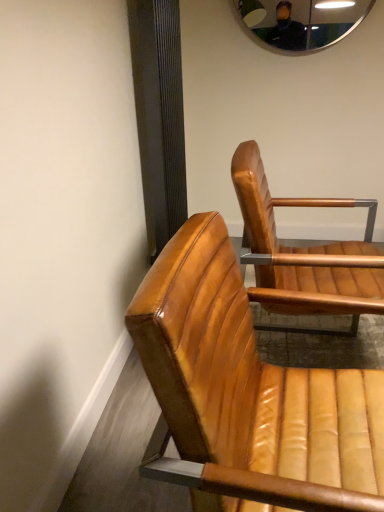
Question: Is leather chair at lower right, which is the 1th chair in front-to-back order, looking in the opposite direction of metallic reflective mirror at upper center?

Choices:
 (A) yes
 (B) no

Answer: (B)

Question: Is leather chair at lower right, positioned as the second chair in back-to-front order, touching metallic reflective mirror at upper center?

Choices:
 (A) no
 (B) yes

Answer: (A)

Question: Considering the relative positions of leather chair at lower right, positioned as the second chair in back-to-front order, and metallic reflective mirror at upper center in the image provided, is leather chair at lower right, positioned as the second chair in back-to-front order, to the right of metallic reflective mirror at upper center from the viewer's perspective?

Choices:
 (A) yes
 (B) no

Answer: (B)

Question: Can you confirm if leather chair at lower right, which is the 1th chair in front-to-back order, is taller than metallic reflective mirror at upper center?

Choices:
 (A) yes
 (B) no

Answer: (A)

Question: Would you say metallic reflective mirror at upper center is part of leather chair at lower right, positioned as the second chair in back-to-front order,'s contents?

Choices:
 (A) yes
 (B) no

Answer: (B)

Question: In terms of height, does leather chair at lower right, positioned as the second chair in back-to-front order, look taller or shorter compared to leather tan chair at center, positioned as the 1th chair in back-to-front order?

Choices:
 (A) tall
 (B) short

Answer: (B)

Question: Is leather chair at lower right, which is the 1th chair in front-to-back order, to the left or to the right of leather tan chair at center, the second chair viewed from the front, in the image?

Choices:
 (A) right
 (B) left

Answer: (B)

Question: Is leather chair at lower right, which is the 1th chair in front-to-back order, spatially inside leather tan chair at center, the second chair viewed from the front, or outside of it?

Choices:
 (A) outside
 (B) inside

Answer: (A)

Question: Looking at the image, does leather chair at lower right, positioned as the second chair in back-to-front order, seem bigger or smaller compared to leather tan chair at center, positioned as the 1th chair in back-to-front order?

Choices:
 (A) small
 (B) big

Answer: (A)

Question: Considering the positions of point (256, 252) and point (347, 384), is point (256, 252) closer or farther from the camera than point (347, 384)?

Choices:
 (A) farther
 (B) closer

Answer: (A)

Question: Looking at the image, does leather tan chair at center, the second chair viewed from the front, seem bigger or smaller compared to leather chair at lower right, which is the 1th chair in front-to-back order?

Choices:
 (A) small
 (B) big

Answer: (B)

Question: From their relative heights in the image, would you say leather tan chair at center, the second chair viewed from the front, is taller or shorter than leather chair at lower right, which is the 1th chair in front-to-back order?

Choices:
 (A) tall
 (B) short

Answer: (A)

Question: Do you think leather tan chair at center, the second chair viewed from the front, is within leather chair at lower right, positioned as the second chair in back-to-front order, or outside of it?

Choices:
 (A) inside
 (B) outside

Answer: (B)

Question: Based on their sizes in the image, would you say metallic reflective mirror at upper center is bigger or smaller than leather tan chair at center, the second chair viewed from the front?

Choices:
 (A) small
 (B) big

Answer: (A)

Question: Is metallic reflective mirror at upper center in front of or behind leather tan chair at center, positioned as the 1th chair in back-to-front order, in the image?

Choices:
 (A) front
 (B) behind

Answer: (B)